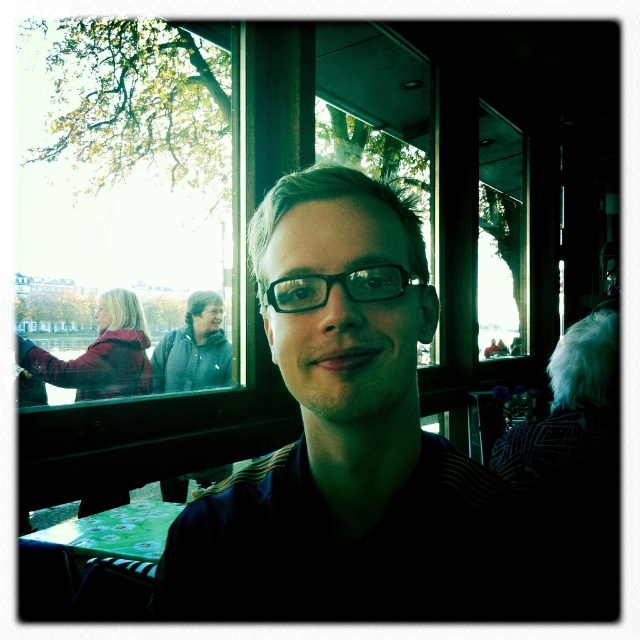
You are trying to determine which object is bigger between the matte black shirt at center and the black plastic glasses at center. Based on the scene, which one is larger?

The matte black shirt at center is larger than the black plastic glasses at center.

You are taking a photo of the person wearing the matte black shirt at center and the black plastic glasses at center. If the camera frame can only fit one of them, which one should you focus on to ensure it captures the wider object?

The matte black shirt at center is wider than the black plastic glasses at center, so you should focus on the matte black shirt at center to ensure it fits within the camera frame.

You are standing in a cafe and see the matte black shirt at center. If you want to take a photo of it without any blur, and your camera requires the subject to be at least 16 inches away, will you need to step back?

The matte black shirt at center is 15.47 inches away from the viewer. Since the required distance is 16 inches, you need to step back approximately 0.53 inches to avoid blur.